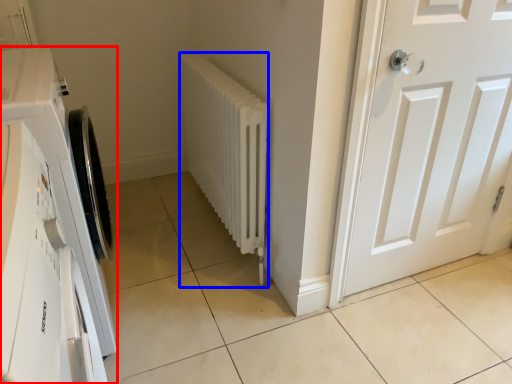
Question: Which point is closer to the camera, washing machine (highlighted by a red box) or radiator (highlighted by a blue box)?

Choices:
 (A) washing machine
 (B) radiator

Answer: (A)